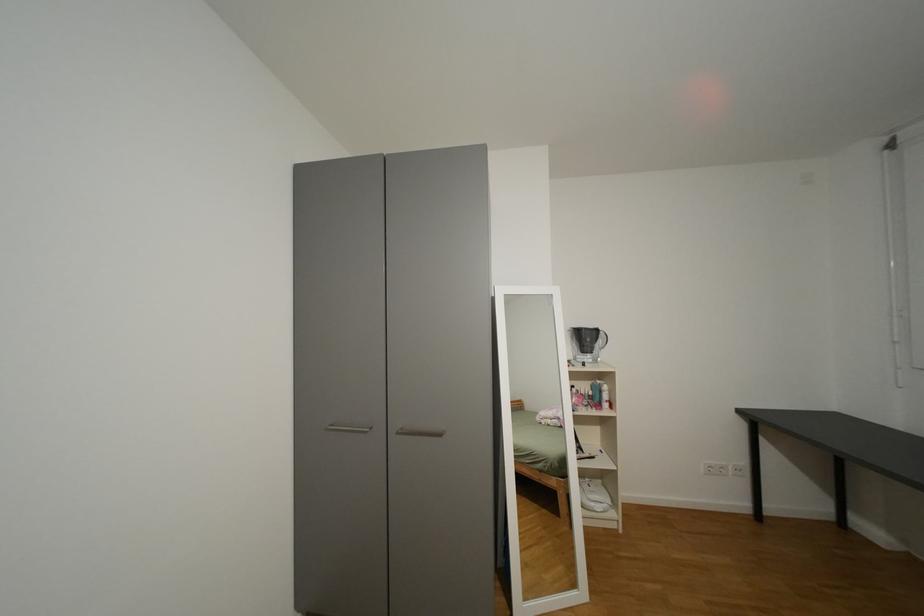
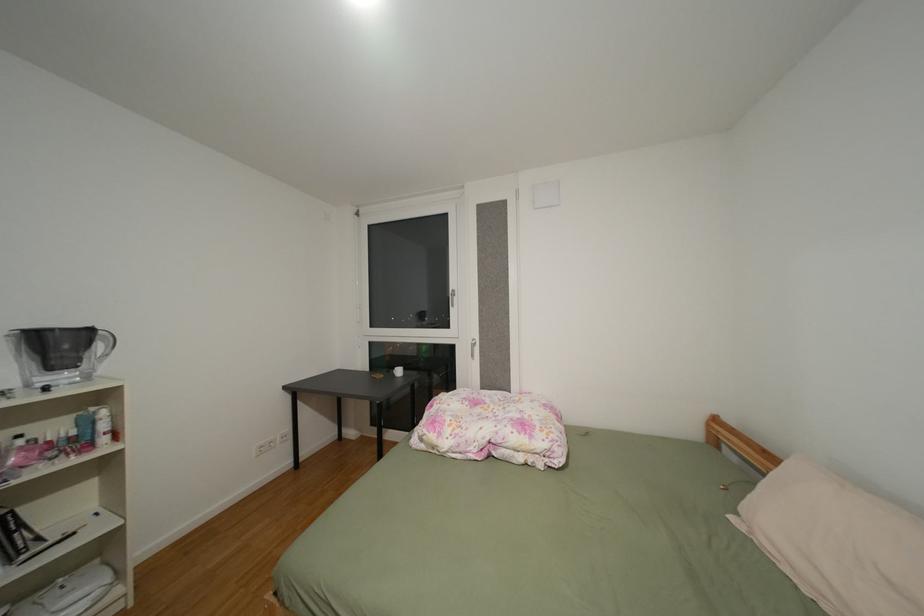
Question: The camera is either moving clockwise (left) or counter-clockwise (right) around the object. The first image is from the beginning of the video and the second image is from the end. Is the camera moving left or right when shooting the video?

Choices:
 (A) Left
 (B) Right

Answer: (A)